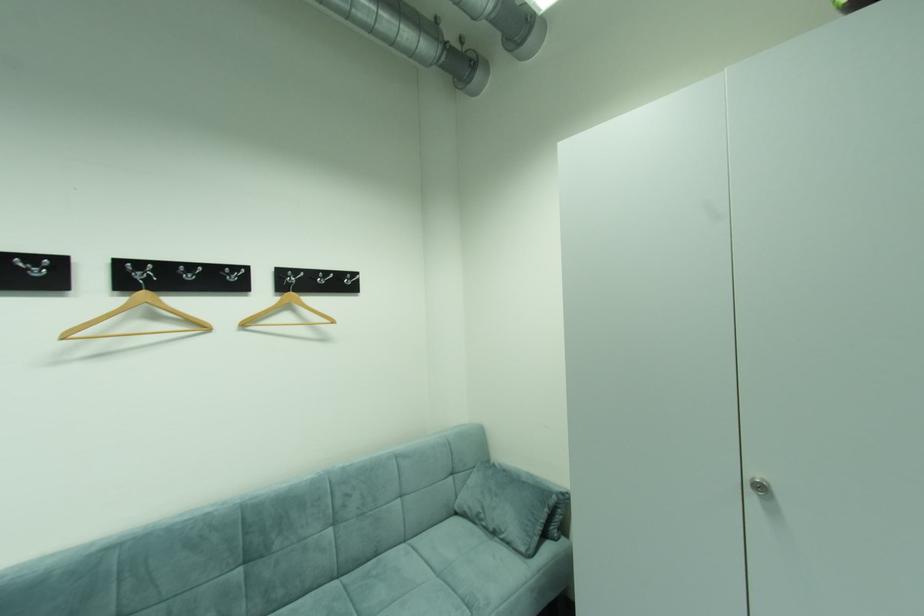
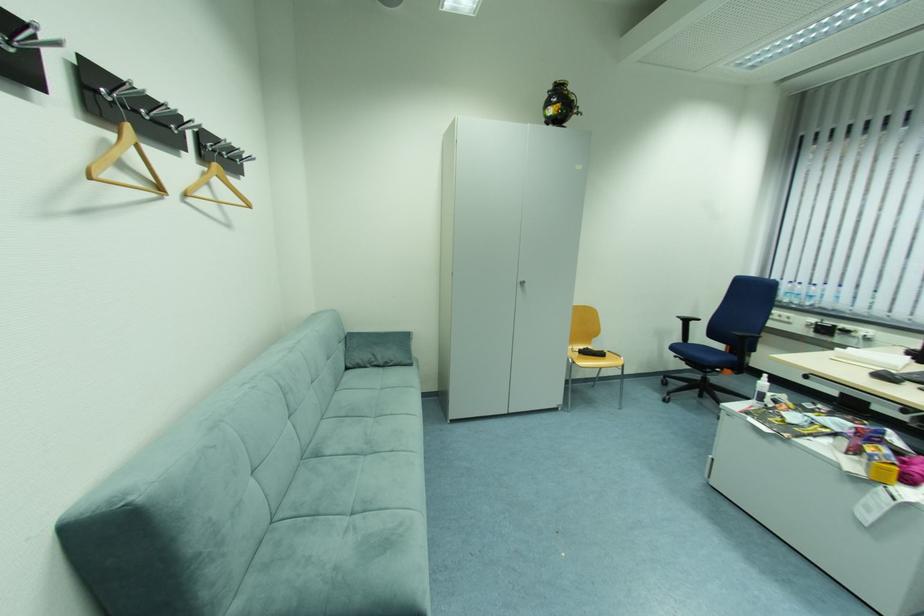
The point at (464, 514) is marked in the first image. Where is the corresponding point in the second image?

(354, 370)